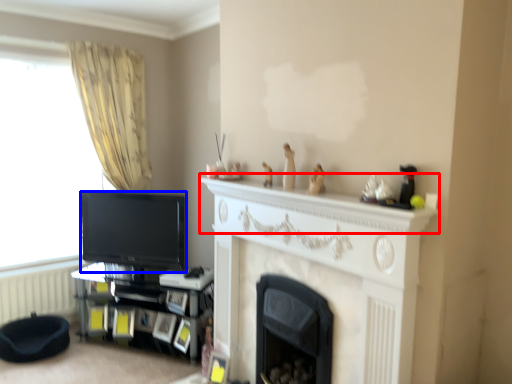
Question: Which of the following is the closest to the observer, mantle (highlighted by a red box) or television (highlighted by a blue box)?

Choices:
 (A) mantle
 (B) television

Answer: (A)